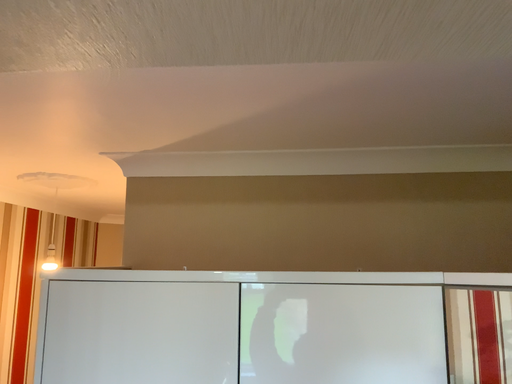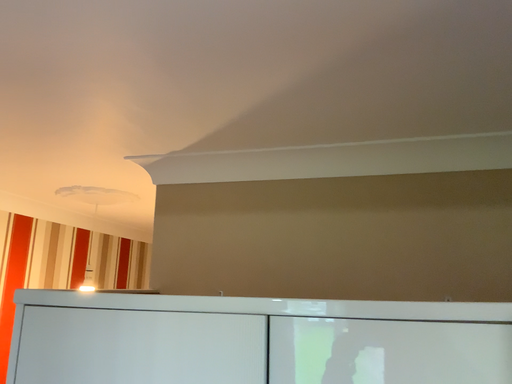
Question: Which way did the camera rotate in the video?

Choices:
 (A) rotated left
 (B) rotated right

Answer: (A)